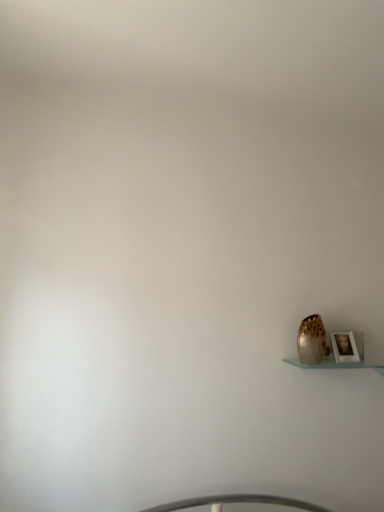
Identify the location of wooden photo frame at lower right. This screenshot has height=512, width=384. (345, 347).

Describe the element at coordinates (345, 347) in the screenshot. The height and width of the screenshot is (512, 384). I see `wooden photo frame at lower right` at that location.

Image resolution: width=384 pixels, height=512 pixels. Describe the element at coordinates (311, 340) in the screenshot. I see `speckled ceramic vase at lower right` at that location.

Measure the distance between speckled ceramic vase at lower right and camera.

The depth of speckled ceramic vase at lower right is 6.20 feet.

Image resolution: width=384 pixels, height=512 pixels. Find the location of `speckled ceramic vase at lower right`. speckled ceramic vase at lower right is located at coordinates (311, 340).

The image size is (384, 512). I want to click on wooden photo frame at lower right, so pyautogui.click(x=345, y=347).

Does speckled ceramic vase at lower right appear on the right side of wooden photo frame at lower right?

No, speckled ceramic vase at lower right is not to the right of wooden photo frame at lower right.

Is speckled ceramic vase at lower right behind wooden photo frame at lower right?

No, speckled ceramic vase at lower right is closer to the camera.

Is point (324, 336) closer to viewer compared to point (343, 362)?

No, it is behind (343, 362).

From the image's perspective, does speckled ceramic vase at lower right appear lower than wooden photo frame at lower right?

No, from the image's perspective, speckled ceramic vase at lower right is not beneath wooden photo frame at lower right.

From a real-world perspective, does speckled ceramic vase at lower right sit lower than wooden photo frame at lower right?

No, from a real-world perspective, speckled ceramic vase at lower right is not beneath wooden photo frame at lower right.

Can you confirm if speckled ceramic vase at lower right is wider than wooden photo frame at lower right?

Indeed, speckled ceramic vase at lower right has a greater width compared to wooden photo frame at lower right.

From their relative heights in the image, would you say speckled ceramic vase at lower right is taller or shorter than wooden photo frame at lower right?

Clearly, speckled ceramic vase at lower right is taller compared to wooden photo frame at lower right.

Considering the sizes of objects speckled ceramic vase at lower right and wooden photo frame at lower right in the image provided, who is smaller, speckled ceramic vase at lower right or wooden photo frame at lower right?

wooden photo frame at lower right.

Can wooden photo frame at lower right be found inside speckled ceramic vase at lower right?

Actually, wooden photo frame at lower right is outside speckled ceramic vase at lower right.

Is speckled ceramic vase at lower right beside wooden photo frame at lower right?

speckled ceramic vase at lower right and wooden photo frame at lower right are not in contact.

Could you tell me if speckled ceramic vase at lower right is facing wooden photo frame at lower right?

No, speckled ceramic vase at lower right is not oriented towards wooden photo frame at lower right.

Locate an element on the screen. vase in front of the wooden photo frame at lower right is located at coordinates (311, 340).

Considering the positions of objects wooden photo frame at lower right and speckled ceramic vase at lower right in the image provided, who is more to the right, wooden photo frame at lower right or speckled ceramic vase at lower right?

Positioned to the right is wooden photo frame at lower right.

Who is more distant, wooden photo frame at lower right or speckled ceramic vase at lower right?

wooden photo frame at lower right is more distant.

Which point is more forward, (343, 332) or (304, 345)?

Positioned in front is point (304, 345).

From the image's perspective, is wooden photo frame at lower right located above or below speckled ceramic vase at lower right?

wooden photo frame at lower right is situated lower than speckled ceramic vase at lower right in the image.

From a real-world perspective, which object stands above the other?

speckled ceramic vase at lower right is physically above.

Does wooden photo frame at lower right have a greater width compared to speckled ceramic vase at lower right?

Incorrect, the width of wooden photo frame at lower right does not surpass that of speckled ceramic vase at lower right.

Considering the sizes of objects wooden photo frame at lower right and speckled ceramic vase at lower right in the image provided, who is shorter, wooden photo frame at lower right or speckled ceramic vase at lower right?

wooden photo frame at lower right is shorter.

Looking at this image, considering the sizes of objects wooden photo frame at lower right and speckled ceramic vase at lower right in the image provided, who is smaller, wooden photo frame at lower right or speckled ceramic vase at lower right?

With smaller size is wooden photo frame at lower right.

Would you say wooden photo frame at lower right is outside speckled ceramic vase at lower right?

Yes, wooden photo frame at lower right is not within speckled ceramic vase at lower right.

Are wooden photo frame at lower right and speckled ceramic vase at lower right far apart?

That's not correct — wooden photo frame at lower right is a little close to speckled ceramic vase at lower right.

Is wooden photo frame at lower right facing towards speckled ceramic vase at lower right?

No, wooden photo frame at lower right does not turn towards speckled ceramic vase at lower right.

From the picture: How different are the orientations of wooden photo frame at lower right and speckled ceramic vase at lower right in degrees?

The angular difference between wooden photo frame at lower right and speckled ceramic vase at lower right is 0.00026 degrees.

This screenshot has height=512, width=384. What are the coordinates of `vase that appears in front of the wooden photo frame at lower right` in the screenshot? It's located at (311, 340).

At what (x,y) coordinates should I click in order to perform the action: click on picture frame that is on the right side of speckled ceramic vase at lower right. Please return your answer as a coordinate pair (x, y). Image resolution: width=384 pixels, height=512 pixels. Looking at the image, I should click on (345, 347).

Locate an element on the screen. This screenshot has height=512, width=384. vase positioned vertically above the wooden photo frame at lower right (from a real-world perspective) is located at coordinates (311, 340).